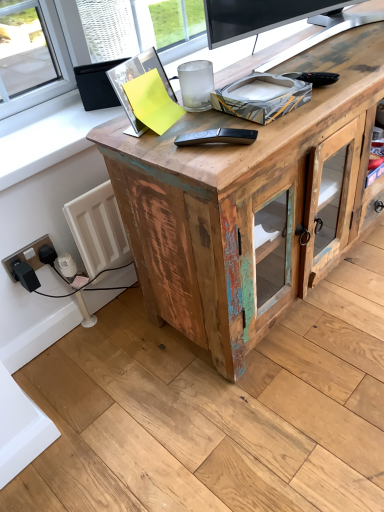
Question: Does black plastic remote control at center have a smaller size compared to weathered wood desk at center?

Choices:
 (A) yes
 (B) no

Answer: (A)

Question: From the image's perspective, is black plastic remote control at center on top of weathered wood desk at center?

Choices:
 (A) yes
 (B) no

Answer: (B)

Question: Considering the relative sizes of black plastic remote control at center and weathered wood desk at center in the image provided, is black plastic remote control at center shorter than weathered wood desk at center?

Choices:
 (A) yes
 (B) no

Answer: (A)

Question: From a real-world perspective, is black plastic remote control at center physically above weathered wood desk at center?

Choices:
 (A) no
 (B) yes

Answer: (B)

Question: Considering the relative positions of black plastic remote control at center and weathered wood desk at center in the image provided, is black plastic remote control at center to the left of weathered wood desk at center from the viewer's perspective?

Choices:
 (A) no
 (B) yes

Answer: (B)

Question: In terms of width, does black plastic socket at lower left look wider or thinner when compared to black plastic remote control at center?

Choices:
 (A) wide
 (B) thin

Answer: (B)

Question: From a real-world perspective, relative to black plastic remote control at center, is black plastic socket at lower left vertically above or below?

Choices:
 (A) below
 (B) above

Answer: (A)

Question: Is black plastic socket at lower left taller or shorter than black plastic remote control at center?

Choices:
 (A) tall
 (B) short

Answer: (A)

Question: Is black plastic socket at lower left situated inside black plastic remote control at center or outside?

Choices:
 (A) outside
 (B) inside

Answer: (A)

Question: Considering the positions of weathered wood desk at center and black plastic remote control at center in the image, is weathered wood desk at center wider or thinner than black plastic remote control at center?

Choices:
 (A) wide
 (B) thin

Answer: (A)

Question: Is weathered wood desk at center taller or shorter than black plastic remote control at center?

Choices:
 (A) short
 (B) tall

Answer: (B)

Question: In the image, is weathered wood desk at center positioned in front of or behind black plastic remote control at center?

Choices:
 (A) behind
 (B) front

Answer: (B)

Question: Based on their sizes in the image, would you say weathered wood desk at center is bigger or smaller than black plastic remote control at center?

Choices:
 (A) big
 (B) small

Answer: (A)

Question: From a real-world perspective, is black plastic remote control at center positioned above or below weathered wood desk at center?

Choices:
 (A) below
 (B) above

Answer: (B)

Question: Is black plastic remote control at center inside the boundaries of weathered wood desk at center, or outside?

Choices:
 (A) outside
 (B) inside

Answer: (A)